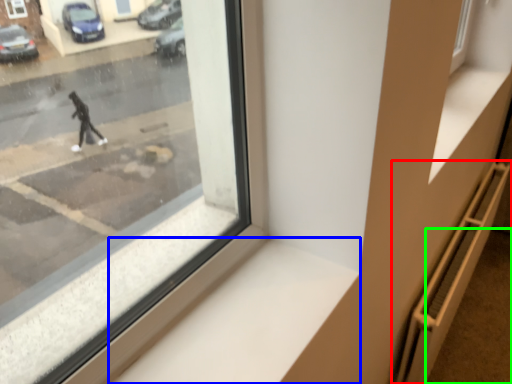
Question: Based on their relative distances, which object is farther from stairwell (highlighted by a red box)? Choose from window sill (highlighted by a blue box) and pavement (highlighted by a green box).

Choices:
 (A) window sill
 (B) pavement

Answer: (A)